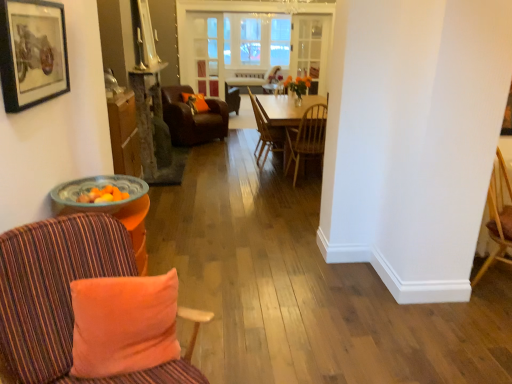
Question: Is orange plush pillow at lower left, which is counted as the second pillow, starting from the top, at the back of wooden chair at center, which is counted as the 2th chair, starting from the front?

Choices:
 (A) no
 (B) yes

Answer: (A)

Question: Could you tell me if wooden chair at center, which is the 3th chair in back-to-front order, is facing orange plush pillow at lower left, the first pillow viewed from the right?

Choices:
 (A) no
 (B) yes

Answer: (A)

Question: From the image's perspective, is wooden chair at center, which is the 3th chair in back-to-front order, located above orange plush pillow at lower left, the first pillow viewed from the right?

Choices:
 (A) yes
 (B) no

Answer: (A)

Question: Is wooden chair at center, which is the 3th chair in back-to-front order, to the left of orange plush pillow at lower left, the 1th pillow when ordered from bottom to top, from the viewer's perspective?

Choices:
 (A) yes
 (B) no

Answer: (B)

Question: From a real-world perspective, is wooden chair at center, which is counted as the 2th chair, starting from the front, on top of orange plush pillow at lower left, which is the second pillow in left-to-right order?

Choices:
 (A) yes
 (B) no

Answer: (B)

Question: From a real-world perspective, is wooden chair at center, which is counted as the 2th chair, starting from the front, physically below orange plush pillow at lower left, which is counted as the second pillow, starting from the top?

Choices:
 (A) no
 (B) yes

Answer: (B)

Question: Is wooden chair at center, positioned as the 2th chair in back-to-front order, looking in the opposite direction of leather armchair at center, the fourth chair in the front-to-back sequence?

Choices:
 (A) yes
 (B) no

Answer: (B)

Question: Is wooden chair at center, positioned as the 2th chair in back-to-front order, positioned in front of leather armchair at center, acting as the first chair starting from the back?

Choices:
 (A) no
 (B) yes

Answer: (B)

Question: Could leather armchair at center, acting as the first chair starting from the back, be considered to be inside wooden chair at center, marked as the 3th chair in a front-to-back arrangement?

Choices:
 (A) yes
 (B) no

Answer: (B)

Question: Can you confirm if wooden chair at center, marked as the 3th chair in a front-to-back arrangement, is positioned to the left of leather armchair at center, acting as the first chair starting from the back?

Choices:
 (A) yes
 (B) no

Answer: (B)

Question: Is wooden chair at center, marked as the 3th chair in a front-to-back arrangement, touching leather armchair at center, the fourth chair in the front-to-back sequence?

Choices:
 (A) yes
 (B) no

Answer: (B)

Question: Can you confirm if wooden chair at center, marked as the 3th chair in a front-to-back arrangement, is bigger than leather armchair at center, the fourth chair in the front-to-back sequence?

Choices:
 (A) yes
 (B) no

Answer: (B)

Question: Considering the relative sizes of striped fabric chair at left, arranged as the first chair when viewed from the front, and wooden chair at center, which is the 3th chair in back-to-front order, in the image provided, is striped fabric chair at left, arranged as the first chair when viewed from the front, bigger than wooden chair at center, which is the 3th chair in back-to-front order,?

Choices:
 (A) yes
 (B) no

Answer: (A)